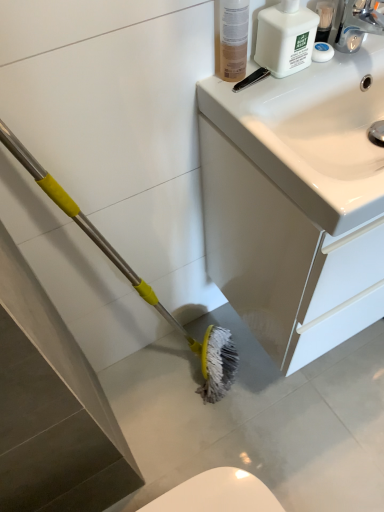
Measure the distance between white glossy sink at upper right and camera.

white glossy sink at upper right and camera are 22.81 inches apart from each other.

Locate an element on the screen. The height and width of the screenshot is (512, 384). white plastic bottle at upper right is located at coordinates (285, 38).

Looking at this image, between translucent plastic bottle at upper right and white plastic bottle at upper right, which one has larger width?

Wider between the two is white plastic bottle at upper right.

At what (x,y) coordinates should I click in order to perform the action: click on toiletry above the white plastic bottle at upper right (from a real-world perspective). Please return your answer as a coordinate pair (x, y). Looking at the image, I should click on pyautogui.click(x=233, y=39).

Based on the photo, does translucent plastic bottle at upper right have a smaller size compared to white plastic bottle at upper right?

Correct, translucent plastic bottle at upper right occupies less space than white plastic bottle at upper right.

From the image's perspective, is white plastic bottle at upper right above or below translucent plastic bottle at upper right?

Clearly, from the image's perspective, white plastic bottle at upper right is above translucent plastic bottle at upper right.

Which object is wider, white plastic bottle at upper right or translucent plastic bottle at upper right?

white plastic bottle at upper right.

From a real-world perspective, between white plastic bottle at upper right and translucent plastic bottle at upper right, who is vertically lower?

white plastic bottle at upper right, from a real-world perspective.

From the image's perspective, is white glossy sink at upper right above or below white plastic bottle at upper right?

From the image's perspective, white glossy sink at upper right appears below white plastic bottle at upper right.

Is white glossy sink at upper right aimed at white plastic bottle at upper right?

No, white glossy sink at upper right does not turn towards white plastic bottle at upper right.

Does point (362, 167) appear closer or farther from the camera than point (267, 34)?

Point (362, 167).

From a real-world perspective, relative to white plastic bottle at upper right, is white glossy sink at upper right vertically above or below?

Clearly, from a real-world perspective, white glossy sink at upper right is below white plastic bottle at upper right.

From the image's perspective, which one is positioned lower, translucent plastic bottle at upper right or white glossy sink at upper right?

From the image's view, white glossy sink at upper right is below.

Considering the relative sizes of translucent plastic bottle at upper right and white glossy sink at upper right in the image provided, is translucent plastic bottle at upper right shorter than white glossy sink at upper right?

Correct, translucent plastic bottle at upper right is not as tall as white glossy sink at upper right.

What's the angular difference between translucent plastic bottle at upper right and white glossy sink at upper right's facing directions?

The angle between the facing direction of translucent plastic bottle at upper right and the facing direction of white glossy sink at upper right is 3.02 degrees.

Which point is more forward, (230,72) or (336,255)?

The point (336,255) is closer to the camera.

Considering the relative sizes of white plastic bottle at upper right and white glossy sink at upper right in the image provided, is white plastic bottle at upper right taller than white glossy sink at upper right?

Incorrect, the height of white plastic bottle at upper right is not larger of that of white glossy sink at upper right.

From the image's perspective, is white plastic bottle at upper right beneath white glossy sink at upper right?

No, from the image's perspective, white plastic bottle at upper right is not beneath white glossy sink at upper right.

Where is `cleaning product behind the white glossy sink at upper right`? The image size is (384, 512). cleaning product behind the white glossy sink at upper right is located at coordinates (285, 38).

Is white plastic bottle at upper right wider or thinner than white glossy sink at upper right?

Considering their sizes, white plastic bottle at upper right looks slimmer than white glossy sink at upper right.

Considering the sizes of objects white glossy sink at upper right and translucent plastic bottle at upper right in the image provided, who is bigger, white glossy sink at upper right or translucent plastic bottle at upper right?

white glossy sink at upper right.

Is white glossy sink at upper right at the right side of translucent plastic bottle at upper right?

Correct, you'll find white glossy sink at upper right to the right of translucent plastic bottle at upper right.

Is white glossy sink at upper right closer to the viewer compared to translucent plastic bottle at upper right?

No, white glossy sink at upper right is behind translucent plastic bottle at upper right.

Is white glossy sink at upper right far from translucent plastic bottle at upper right?

That's not correct — white glossy sink at upper right is a little close to translucent plastic bottle at upper right.

Identify the location of cleaning product above the translucent plastic bottle at upper right (from the image's perspective). (285, 38).

You are a GUI agent. You are given a task and a screenshot of the screen. Output one action in this format:
    pyautogui.click(x=<x>, y=<y>)
    Task: Click on the toiletry above the white plastic bottle at upper right (from a real-world perspective)
    The width and height of the screenshot is (384, 512).
    Given the screenshot: What is the action you would take?
    pyautogui.click(x=233, y=39)

When comparing their distances from white glossy sink at upper right, does translucent plastic bottle at upper right or white plastic bottle at upper right seem closer?

white plastic bottle at upper right.

Which object lies further to the anchor point translucent plastic bottle at upper right, white glossy sink at upper right or white plastic bottle at upper right?

Among the two, white glossy sink at upper right is located further to translucent plastic bottle at upper right.

From the image, which object appears to be nearer to translucent plastic bottle at upper right, white plastic bottle at upper right or white glossy sink at upper right?

white plastic bottle at upper right is positioned closer to the anchor translucent plastic bottle at upper right.

When comparing their distances from white plastic bottle at upper right, does translucent plastic bottle at upper right or white glossy sink at upper right seem further?

white glossy sink at upper right is positioned further to the anchor white plastic bottle at upper right.

Considering their positions, is white plastic bottle at upper right positioned further to white glossy sink at upper right than translucent plastic bottle at upper right?

Among the two, translucent plastic bottle at upper right is located further to white glossy sink at upper right.

Estimate the real-world distances between objects in this image. Which object is closer to white plastic bottle at upper right, white glossy sink at upper right or translucent plastic bottle at upper right?

translucent plastic bottle at upper right is closer to white plastic bottle at upper right.

Where is `toiletry between white plastic bottle at upper right and white glossy sink at upper right in the up-down direction`? The width and height of the screenshot is (384, 512). toiletry between white plastic bottle at upper right and white glossy sink at upper right in the up-down direction is located at coordinates (233, 39).